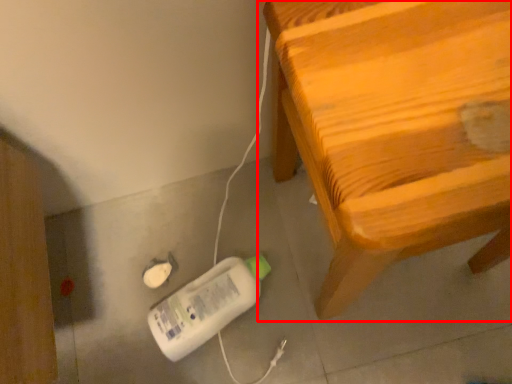
Question: Observing the image, what is the correct spatial positioning of furniture (annotated by the red box) in reference to equipment?

Choices:
 (A) right
 (B) left

Answer: (A)